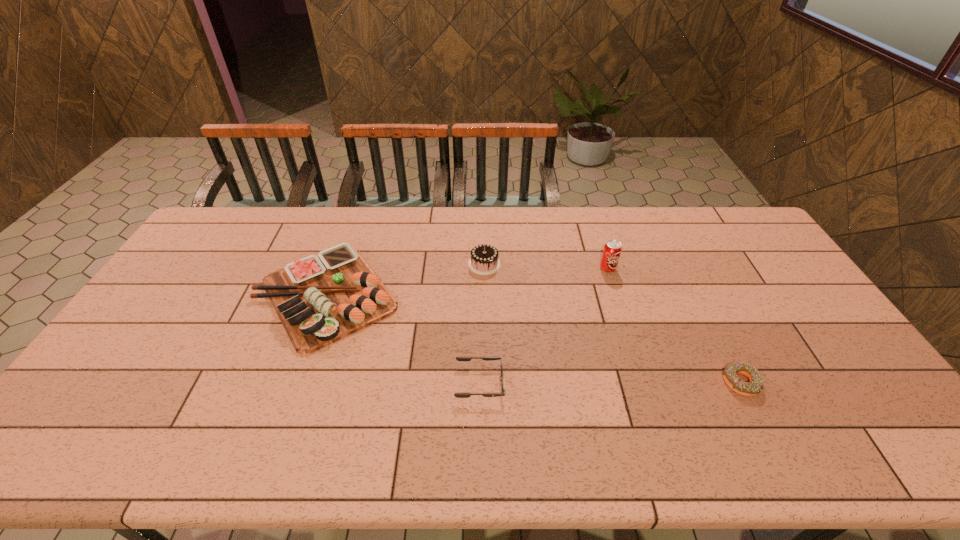
Where is `the tallest object`? The height and width of the screenshot is (540, 960). the tallest object is located at coordinates (612, 249).

Find the location of a particular element. This screenshot has height=540, width=960. soda is located at coordinates (612, 249).

Where is `the second tallest object`? The image size is (960, 540). the second tallest object is located at coordinates (484, 260).

You are a GUI agent. You are given a task and a screenshot of the screen. Output one action in this format:
    pyautogui.click(x=<x>, y=<y>)
    Task: Click on the leftmost object
    
    Given the screenshot: What is the action you would take?
    pyautogui.click(x=319, y=299)

Identify the location of the third shortest object. (319, 299).

Where is `the rightmost object`? the rightmost object is located at coordinates (754, 387).

The image size is (960, 540). I want to click on sunglasses, so [x=459, y=395].

This screenshot has width=960, height=540. In order to click on vacant region located on the back of the soda in this screenshot , I will do `click(598, 238)`.

Find the location of a particular element. free spot located on the front of the chocolate cake is located at coordinates (486, 345).

Locate an element on the screen. The width and height of the screenshot is (960, 540). free space located on the front of the platter is located at coordinates (284, 415).